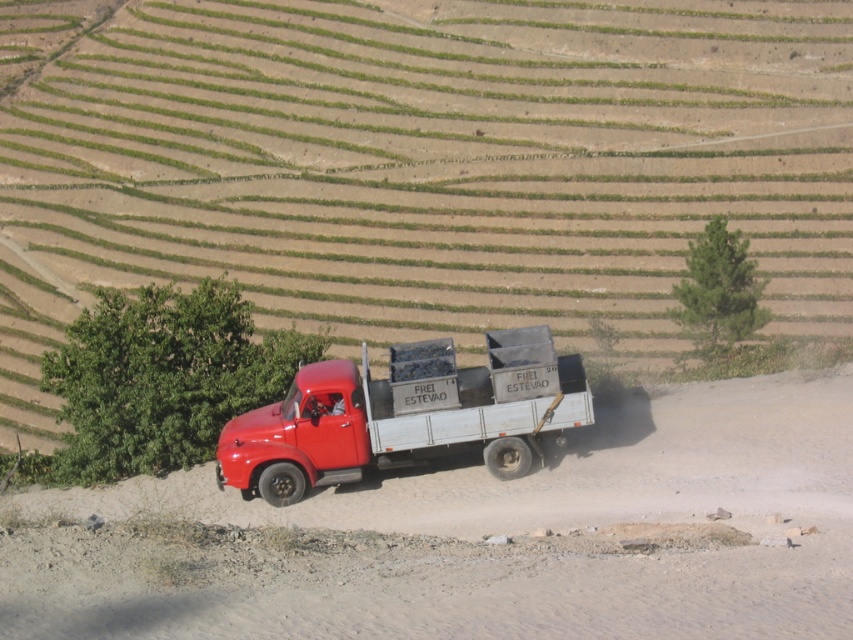
Question: Which object is closer to the camera taking this photo?

Choices:
 (A) shiny red truck at center
 (B) dusty gravel road at lower center

Answer: (B)

Question: Can you confirm if dusty gravel road at lower center is positioned to the left of shiny red truck at center?

Choices:
 (A) no
 (B) yes

Answer: (A)

Question: Is dusty gravel road at lower center to the right of shiny red truck at center from the viewer's perspective?

Choices:
 (A) no
 (B) yes

Answer: (B)

Question: Can you confirm if dusty gravel road at lower center is positioned to the left of shiny red truck at center?

Choices:
 (A) yes
 (B) no

Answer: (B)

Question: Which point is farther from the camera taking this photo?

Choices:
 (A) (445, 506)
 (B) (339, 426)

Answer: (B)